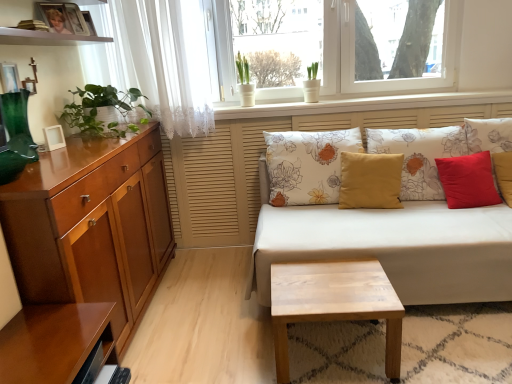
Question: Is white glossy pot at upper center behind green glass vase at left?

Choices:
 (A) no
 (B) yes

Answer: (B)

Question: From a real-world perspective, is white glossy pot at upper center positioned under green glass vase at left based on gravity?

Choices:
 (A) yes
 (B) no

Answer: (B)

Question: Considering the relative sizes of white glossy pot at upper center and green glass vase at left in the image provided, is white glossy pot at upper center wider than green glass vase at left?

Choices:
 (A) no
 (B) yes

Answer: (A)

Question: Does white glossy pot at upper center turn towards green glass vase at left?

Choices:
 (A) no
 (B) yes

Answer: (A)

Question: Can you confirm if white glossy pot at upper center is positioned to the left of green glass vase at left?

Choices:
 (A) no
 (B) yes

Answer: (A)

Question: Can you confirm if white glossy pot at upper center is taller than green glass vase at left?

Choices:
 (A) no
 (B) yes

Answer: (B)

Question: Is floral fabric cushion at center, which appears as the fifth pillow when viewed from the right, beside green leafy plant at left?

Choices:
 (A) yes
 (B) no

Answer: (B)

Question: Does floral fabric cushion at center, which appears as the first pillow when viewed from the left, appear on the left side of green leafy plant at left?

Choices:
 (A) no
 (B) yes

Answer: (A)

Question: Is floral fabric cushion at center, which appears as the fifth pillow when viewed from the right, completely or partially outside of green leafy plant at left?

Choices:
 (A) yes
 (B) no

Answer: (A)

Question: Can you confirm if floral fabric cushion at center, which appears as the fifth pillow when viewed from the right, is bigger than green leafy plant at left?

Choices:
 (A) no
 (B) yes

Answer: (B)

Question: Is floral fabric cushion at center, which appears as the fifth pillow when viewed from the right, positioned behind green leafy plant at left?

Choices:
 (A) no
 (B) yes

Answer: (B)

Question: Is floral fabric cushion at center, which appears as the first pillow when viewed from the left, thinner than green leafy plant at left?

Choices:
 (A) no
 (B) yes

Answer: (B)

Question: Does white floral fabric couch at center have a smaller size compared to green glass vase at left?

Choices:
 (A) yes
 (B) no

Answer: (B)